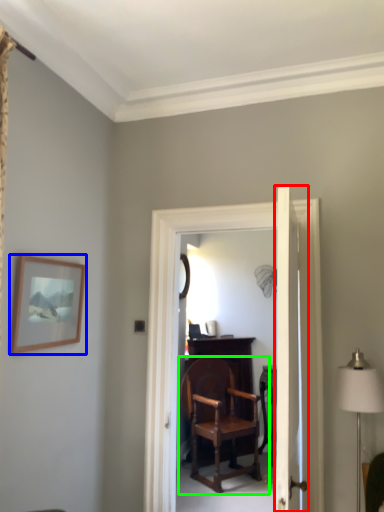
Question: Which object is the farthest from door (highlighted by a red box)? Choose among these: picture frame (highlighted by a blue box) or chair (highlighted by a green box).

Choices:
 (A) picture frame
 (B) chair

Answer: (B)